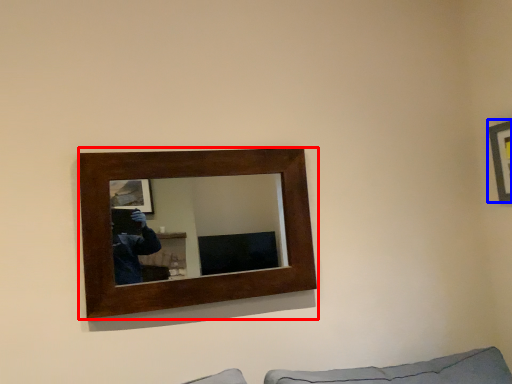
Question: Which of the following is the closest to the observer, picture frame (highlighted by a red box) or picture frame (highlighted by a blue box)?

Choices:
 (A) picture frame
 (B) picture frame

Answer: (A)